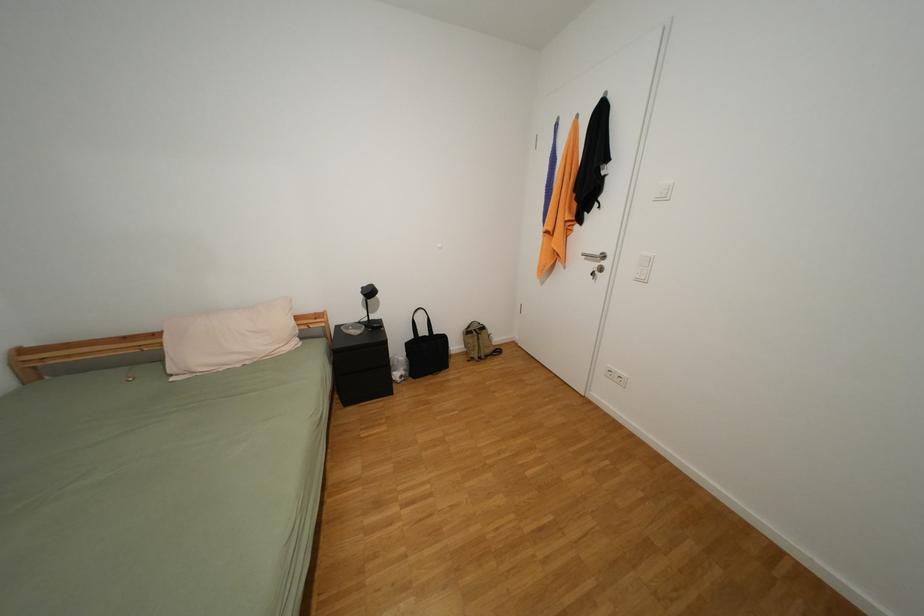
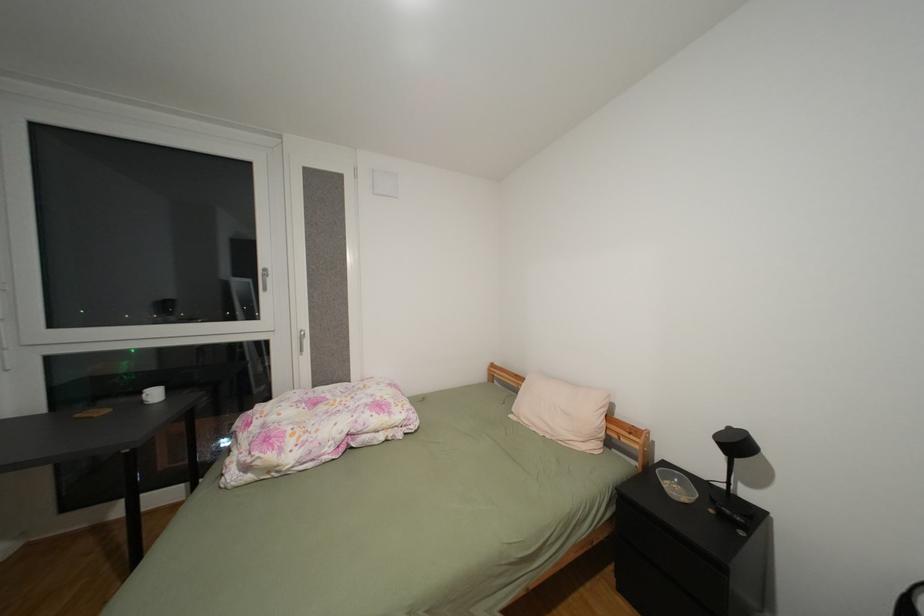
Question: The camera is either moving clockwise (left) or counter-clockwise (right) around the object. The first image is from the beginning of the video and the second image is from the end. Is the camera moving left or right when shooting the video?

Choices:
 (A) Left
 (B) Right

Answer: (B)